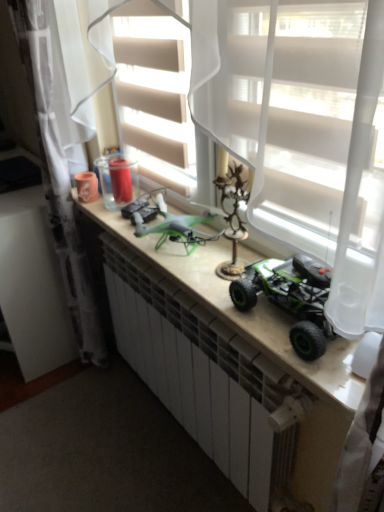
The width and height of the screenshot is (384, 512). Describe the element at coordinates (58, 178) in the screenshot. I see `white sheer curtain at upper left, which is the first curtain in left-to-right order` at that location.

At what (x,y) coordinates should I click in order to perform the action: click on matte white counter at center. Please return your answer as a coordinate pair (x, y). This screenshot has width=384, height=512. Looking at the image, I should click on (260, 345).

Is white sheer curtain at upper left, which is the first curtain in left-to-right order, thinner than white sheer curtain at center, the second curtain from the left?

In fact, white sheer curtain at upper left, which is the first curtain in left-to-right order, might be wider than white sheer curtain at center, the second curtain from the left.

Between white sheer curtain at upper left, marked as the 2th curtain in a right-to-left arrangement, and white sheer curtain at center, positioned as the 1th curtain in right-to-left order, which one has more height?

white sheer curtain at upper left, marked as the 2th curtain in a right-to-left arrangement.

Is white sheer curtain at upper left, marked as the 2th curtain in a right-to-left arrangement, directly adjacent to white sheer curtain at center, the second curtain from the left?

white sheer curtain at upper left, marked as the 2th curtain in a right-to-left arrangement, and white sheer curtain at center, the second curtain from the left, are clearly separated.

From the picture: Between white sheer curtain at upper left, which is the first curtain in left-to-right order, and white sheer curtain at center, the second curtain from the left, which one is positioned behind?

white sheer curtain at upper left, which is the first curtain in left-to-right order, is more distant.

Based on their sizes in the image, would you say white sheer curtain at upper left, marked as the 2th curtain in a right-to-left arrangement, is bigger or smaller than matte white counter at center?

Clearly, white sheer curtain at upper left, marked as the 2th curtain in a right-to-left arrangement, is larger in size than matte white counter at center.

Are white sheer curtain at upper left, which is the first curtain in left-to-right order, and matte white counter at center making contact?

white sheer curtain at upper left, which is the first curtain in left-to-right order, is not next to matte white counter at center, and they're not touching.

From the picture: Can you tell me how much white sheer curtain at upper left, which is the first curtain in left-to-right order, and matte white counter at center differ in facing direction?

white sheer curtain at upper left, which is the first curtain in left-to-right order, and matte white counter at center are facing 2.16 degrees away from each other.

Looking at this image, considering their positions, is white sheer curtain at upper left, marked as the 2th curtain in a right-to-left arrangement, located in front of or behind matte white counter at center?

white sheer curtain at upper left, marked as the 2th curtain in a right-to-left arrangement, is behind matte white counter at center.

Which object is further away from the camera taking this photo, white sheer curtain at center, positioned as the 1th curtain in right-to-left order, or white sheer curtain at upper left, marked as the 2th curtain in a right-to-left arrangement?

white sheer curtain at upper left, marked as the 2th curtain in a right-to-left arrangement.

Is white sheer curtain at center, the second curtain from the left, turned away from white sheer curtain at upper left, which is the first curtain in left-to-right order?

white sheer curtain at center, the second curtain from the left, is not turned away from white sheer curtain at upper left, which is the first curtain in left-to-right order.

Which object is positioned more to the left, white sheer curtain at center, positioned as the 1th curtain in right-to-left order, or white sheer curtain at upper left, marked as the 2th curtain in a right-to-left arrangement?

From the viewer's perspective, white sheer curtain at upper left, marked as the 2th curtain in a right-to-left arrangement, appears more on the left side.

Considering the sizes of white sheer curtain at center, the second curtain from the left, and white sheer curtain at upper left, marked as the 2th curtain in a right-to-left arrangement, in the image, is white sheer curtain at center, the second curtain from the left, taller or shorter than white sheer curtain at upper left, marked as the 2th curtain in a right-to-left arrangement,?

Clearly, white sheer curtain at center, the second curtain from the left, is shorter compared to white sheer curtain at upper left, marked as the 2th curtain in a right-to-left arrangement.

Between matte white counter at center and white sheer curtain at center, positioned as the 1th curtain in right-to-left order, which one has more height?

white sheer curtain at center, positioned as the 1th curtain in right-to-left order.

From a real-world perspective, which object rests below the other?

matte white counter at center is physically lower.

Is matte white counter at center further to camera compared to white sheer curtain at center, positioned as the 1th curtain in right-to-left order?

Yes.

Where is `curtain behind the matte white counter at center`? curtain behind the matte white counter at center is located at coordinates (58, 178).

From the picture: How many degrees apart are the facing directions of matte white counter at center and white sheer curtain at upper left, which is the first curtain in left-to-right order?

2.16 degrees.

Considering the positions of points (323, 480) and (67, 178), is point (323, 480) farther from camera compared to point (67, 178)?

No, it is in front of (67, 178).

Is the surface of matte white counter at center in direct contact with white sheer curtain at upper left, which is the first curtain in left-to-right order?

No, matte white counter at center is not next to white sheer curtain at upper left, which is the first curtain in left-to-right order.

Is white sheer curtain at center, positioned as the 1th curtain in right-to-left order, located outside matte white counter at center?

Yes, white sheer curtain at center, positioned as the 1th curtain in right-to-left order, is outside of matte white counter at center.

From the image's perspective, which is below, white sheer curtain at center, the second curtain from the left, or matte white counter at center?

matte white counter at center is shown below in the image.

Consider the image. Can you confirm if white sheer curtain at center, the second curtain from the left, is positioned to the left of matte white counter at center?

Incorrect, white sheer curtain at center, the second curtain from the left, is not on the left side of matte white counter at center.

This screenshot has height=512, width=384. In order to click on curtain that is below the white sheer curtain at center, positioned as the 1th curtain in right-to-left order (from the image's perspective) in this screenshot , I will do `click(58, 178)`.

In order to click on the 1st curtain above the matte white counter at center (from the image's perspective) in this screenshot , I will do `click(58, 178)`.

Looking at the image, which one is located closer to white sheer curtain at center, positioned as the 1th curtain in right-to-left order, white sheer curtain at upper left, which is the first curtain in left-to-right order, or matte white counter at center?

matte white counter at center lies closer to white sheer curtain at center, positioned as the 1th curtain in right-to-left order, than the other object.

Looking at the image, which one is located closer to matte white counter at center, white sheer curtain at upper left, which is the first curtain in left-to-right order, or white sheer curtain at center, positioned as the 1th curtain in right-to-left order?

The object closer to matte white counter at center is white sheer curtain at center, positioned as the 1th curtain in right-to-left order.

Based on their spatial positions, is white sheer curtain at center, positioned as the 1th curtain in right-to-left order, or white sheer curtain at upper left, which is the first curtain in left-to-right order, further from matte white counter at center?

white sheer curtain at upper left, which is the first curtain in left-to-right order, is further to matte white counter at center.

Which object lies nearer to the anchor point white sheer curtain at upper left, marked as the 2th curtain in a right-to-left arrangement, matte white counter at center or white sheer curtain at center, positioned as the 1th curtain in right-to-left order?

Based on the image, matte white counter at center appears to be nearer to white sheer curtain at upper left, marked as the 2th curtain in a right-to-left arrangement.

From the image, which object appears to be farther from white sheer curtain at upper left, which is the first curtain in left-to-right order, white sheer curtain at center, positioned as the 1th curtain in right-to-left order, or matte white counter at center?

white sheer curtain at center, positioned as the 1th curtain in right-to-left order.

Looking at the image, which one is located further to white sheer curtain at center, the second curtain from the left, matte white counter at center or white sheer curtain at upper left, marked as the 2th curtain in a right-to-left arrangement?

white sheer curtain at upper left, marked as the 2th curtain in a right-to-left arrangement, lies further to white sheer curtain at center, the second curtain from the left, than the other object.

Where is `curtain between white sheer curtain at center, the second curtain from the left, and matte white counter at center vertically`? The image size is (384, 512). curtain between white sheer curtain at center, the second curtain from the left, and matte white counter at center vertically is located at coordinates (58, 178).